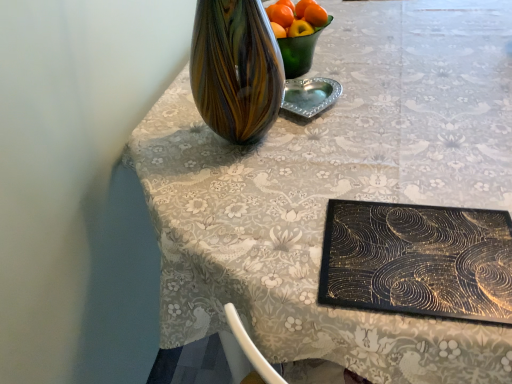
The width and height of the screenshot is (512, 384). In order to click on vacant location behind silver metallic heart-shaped tray at center in this screenshot , I will do `click(322, 68)`.